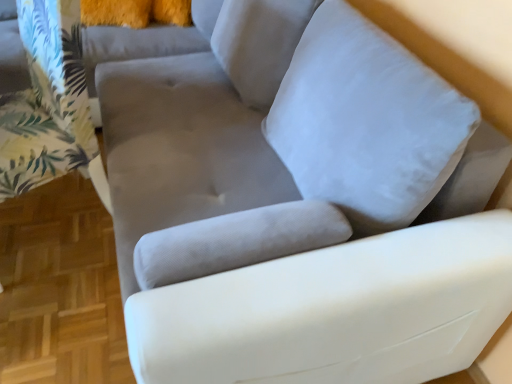
The width and height of the screenshot is (512, 384). What are the coordinates of `green leafy fabric at left` in the screenshot? It's located at (46, 102).

This screenshot has width=512, height=384. Describe the element at coordinates (46, 102) in the screenshot. I see `green leafy fabric at left` at that location.

Measure the distance between green leafy fabric at left and camera.

The distance of green leafy fabric at left from camera is 1.14 meters.

Where is `green leafy fabric at left`? The height and width of the screenshot is (384, 512). green leafy fabric at left is located at coordinates (46, 102).